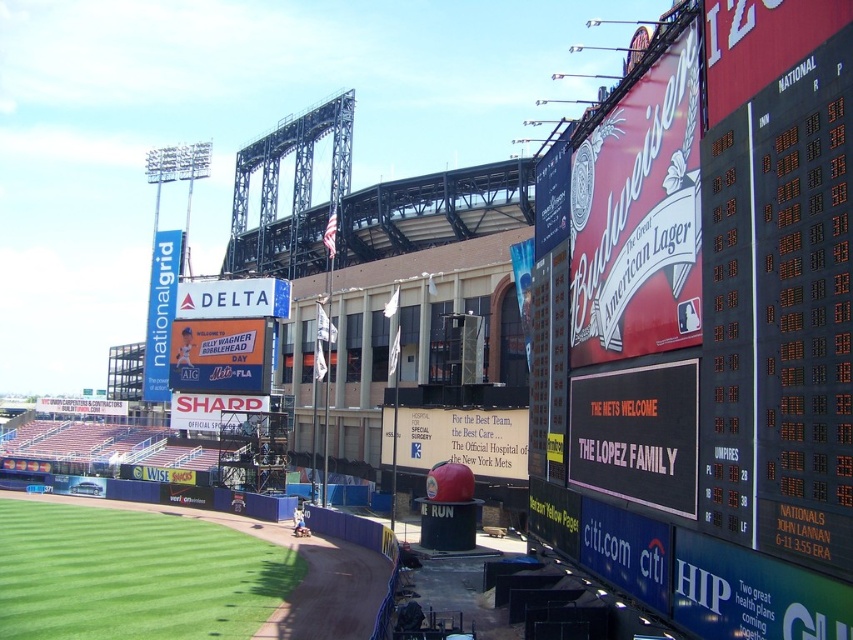
You are a photographer trying to capture a wide shot of the baseball stadium. You want to include both the black plastic scoreboard at upper right and the green artificial turf at lower left in your frame. Given their sizes, which object should you focus on to ensure both are visible without cropping?

The black plastic scoreboard at upper right is larger in size than the green artificial turf at lower left. To ensure both are visible without cropping, focus on framing the larger object, the black plastic scoreboard at upper right, while still including the smaller green artificial turf at lower left in the shot.

You are standing at the center of the baseball field and want to reach the point marked at coordinates point (759,298). How far will you have to walk to get there?

The point (759,298) is 88.16 feet away from the viewer, so you will have to walk 88.16 feet to reach it.

You are a photographer standing at the edge of the baseball field. You want to capture a clear photo of the black plastic scoreboard at upper right without any obstructions. Considering your current position, can you estimate if you need to move closer or farther away to ensure the scoreboard fills the frame adequately?

The black plastic scoreboard at upper right is 72.56 feet from the viewer. To ensure the scoreboard fills the frame adequately, you would need to move closer since it is currently farther away than the ideal distance for a clear, unobstructed shot.